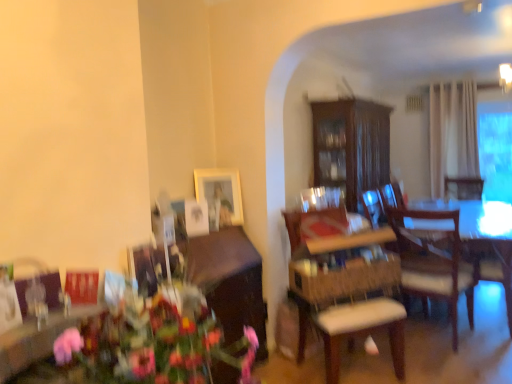
I want to click on vacant space underneath wooden armchair at right (from a real-world perspective), so click(x=479, y=316).